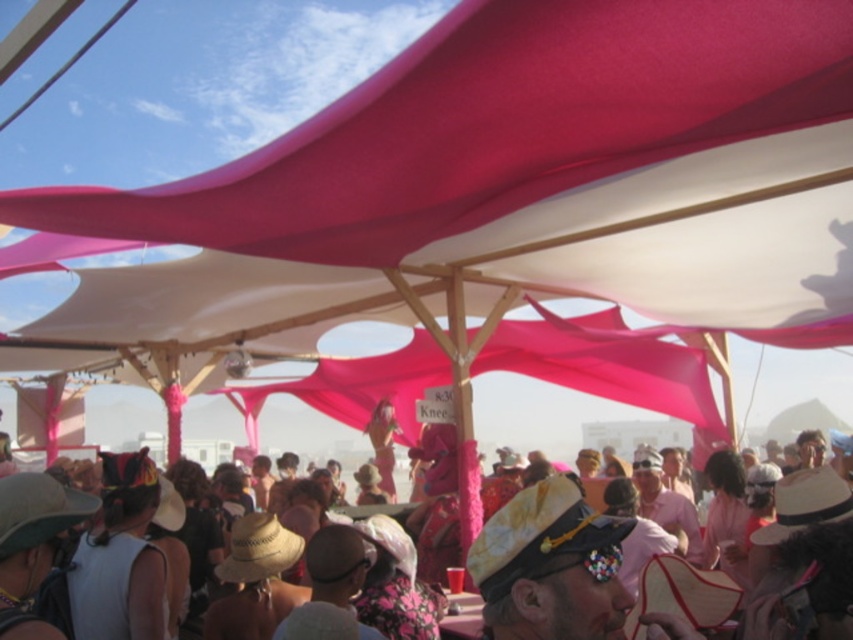
Question: Does matte pink fabric canopy at upper center appear on the right side of pink fabric canopy at center?

Choices:
 (A) yes
 (B) no

Answer: (B)

Question: Which point is farther to the camera?

Choices:
 (A) matte pink fabric canopy at upper center
 (B) pink fabric canopy at center

Answer: (A)

Question: Can you confirm if matte pink fabric canopy at upper center is positioned above pink fabric canopy at center?

Choices:
 (A) yes
 (B) no

Answer: (A)

Question: Is matte pink fabric canopy at upper center to the left of pink fabric canopy at center from the viewer's perspective?

Choices:
 (A) yes
 (B) no

Answer: (A)